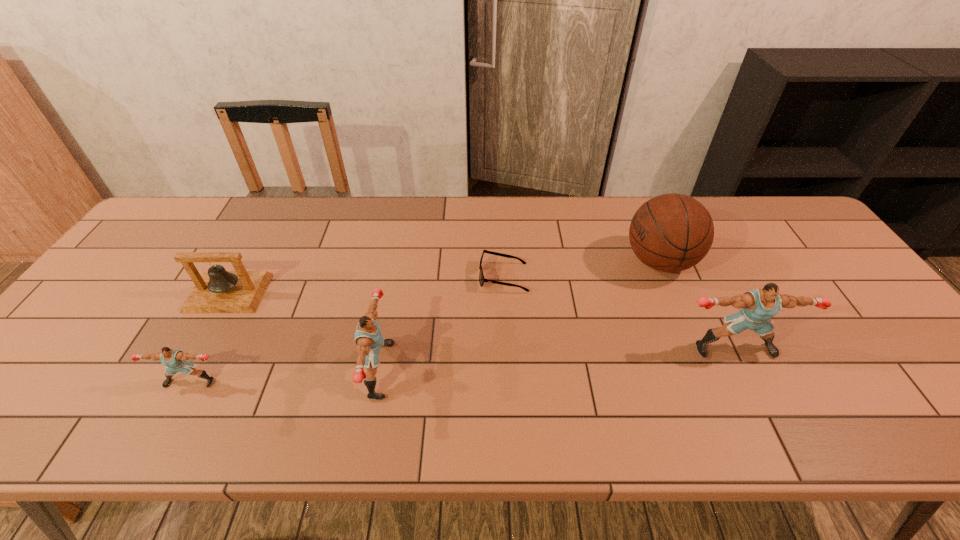
This screenshot has width=960, height=540. What are the coordinates of `unoccupied area between the basketball and the bell` in the screenshot? It's located at (444, 277).

Identify the location of free space that is in between the bell and the rightmost puncher. The image size is (960, 540). (481, 321).

The width and height of the screenshot is (960, 540). What are the coordinates of `free spot between the rightmost puncher and the bell` in the screenshot? It's located at (481, 321).

The height and width of the screenshot is (540, 960). I want to click on the second closest object to the leftmost puncher, so click(368, 337).

Point out which object is positioned as the second nearest to the rightmost puncher. Please provide its 2D coordinates. Your answer should be formatted as a tuple, i.e. [(x, y)], where the tuple contains the x and y coordinates of a point satisfying the conditions above.

[(481, 276)]

This screenshot has width=960, height=540. Find the location of `the second closest puncher to the rightmost puncher`. the second closest puncher to the rightmost puncher is located at coordinates (175, 360).

Identify which puncher is the third closest to the third object from right to left. Please provide its 2D coordinates. Your answer should be formatted as a tuple, i.e. [(x, y)], where the tuple contains the x and y coordinates of a point satisfying the conditions above.

[(175, 360)]

What are the coordinates of `vacant position in the image that satisfies the following two spatial constraints: 1. on the side with brand label of the basketball; 2. on the front-facing side of the shortest puncher` in the screenshot? It's located at pos(709,382).

The height and width of the screenshot is (540, 960). I want to click on vacant space that satisfies the following two spatial constraints: 1. on the front-facing side of the rightmost puncher; 2. on the front-facing side of the second puncher from right to left, so click(744, 370).

Image resolution: width=960 pixels, height=540 pixels. Identify the location of free space in the image that satisfies the following two spatial constraints: 1. on the front-facing side of the sunglasses; 2. on the front-facing side of the shortest puncher. (509, 382).